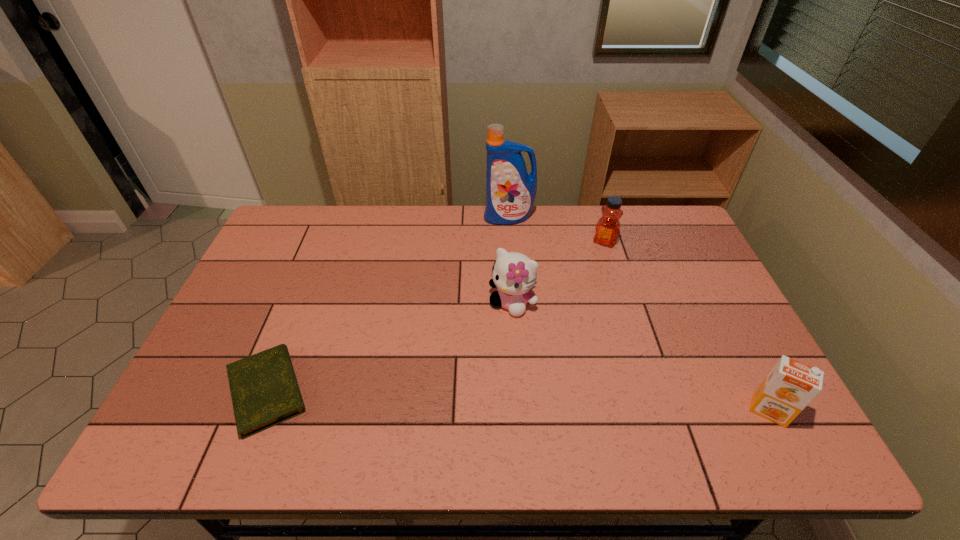
Locate an element on the screen. The width and height of the screenshot is (960, 540). detergent positioned at the far edge is located at coordinates (510, 190).

Locate an element on the screen. diary at the near edge is located at coordinates tap(264, 389).

You are a GUI agent. You are given a task and a screenshot of the screen. Output one action in this format:
    pyautogui.click(x=<x>, y=<y>)
    Task: Click on the orange juice that is at the near edge
    The height and width of the screenshot is (540, 960).
    Given the screenshot: What is the action you would take?
    pyautogui.click(x=790, y=386)

At what (x,y) coordinates should I click in order to perform the action: click on object at the left edge. Please return your answer as a coordinate pair (x, y). Looking at the image, I should click on (264, 389).

You are a GUI agent. You are given a task and a screenshot of the screen. Output one action in this format:
    pyautogui.click(x=<x>, y=<y>)
    Task: Click on the object at the right edge
    
    Given the screenshot: What is the action you would take?
    pyautogui.click(x=790, y=386)

This screenshot has width=960, height=540. Find the location of `object located in the near left corner section of the desktop`. object located in the near left corner section of the desktop is located at coordinates (264, 389).

Locate an element on the screen. Image resolution: width=960 pixels, height=540 pixels. object located in the near right corner section of the desktop is located at coordinates (790, 386).

This screenshot has height=540, width=960. Find the location of `vacant space at the far edge of the desktop`. vacant space at the far edge of the desktop is located at coordinates (339, 232).

You are a GUI agent. You are given a task and a screenshot of the screen. Output one action in this format:
    pyautogui.click(x=<x>, y=<y>)
    Task: Click on the free space at the near edge of the desktop
    
    Given the screenshot: What is the action you would take?
    pyautogui.click(x=670, y=393)

Locate an element on the screen. vacant space at the left edge of the desktop is located at coordinates (272, 327).